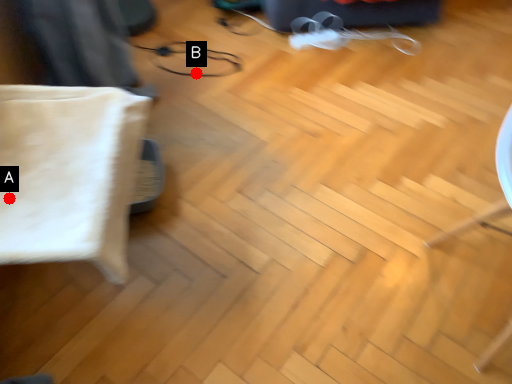
Question: Two points are circled on the image, labeled by A and B beside each circle. Which point is farther from the camera taking this photo?

Choices:
 (A) A is further
 (B) B is further

Answer: (B)